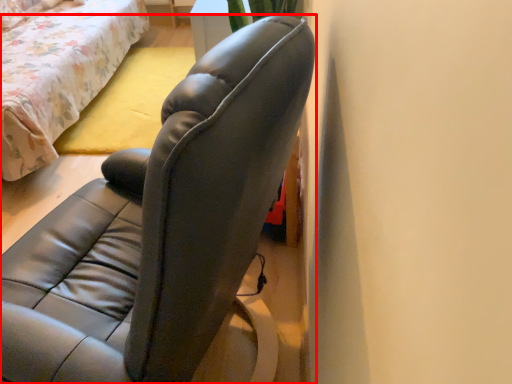
Question: Where is chair (annotated by the red box) located in relation to bed in the image?

Choices:
 (A) left
 (B) right

Answer: (B)